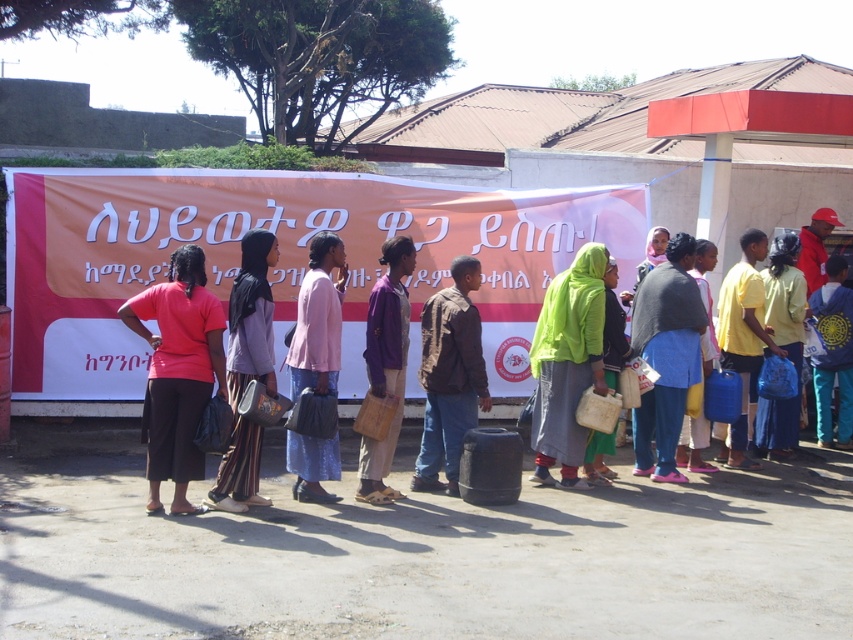
You are a photographer positioned at the front of the line. You want to capture both the matte pink shirt at left and the pink fabric dress at center in your shot. Which one will appear larger in the photo?

The matte pink shirt at left will appear larger in the photo because it is closer to the viewer than the pink fabric dress at center.

You are standing at the point with coordinates (450,376) in the image. What object are you standing on?

The point at (450,376) is on the brown leather jacket at center.

You are standing in the line of people waiting. There are two points marked in the scene. One is at coordinates point (155, 368) and the other at point (322, 465). Which point is closer to you?

Point (155, 368) is closer to the viewer than point (322, 465).